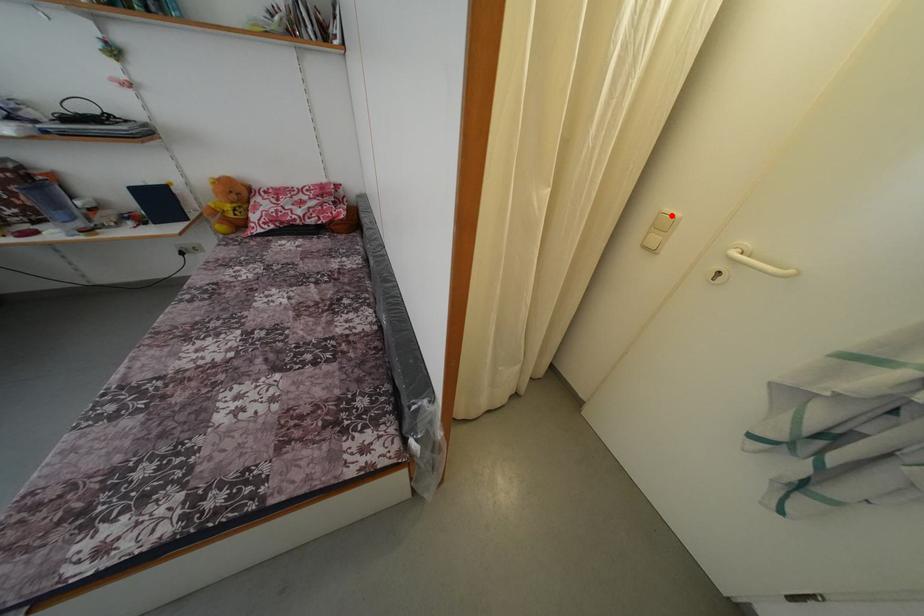
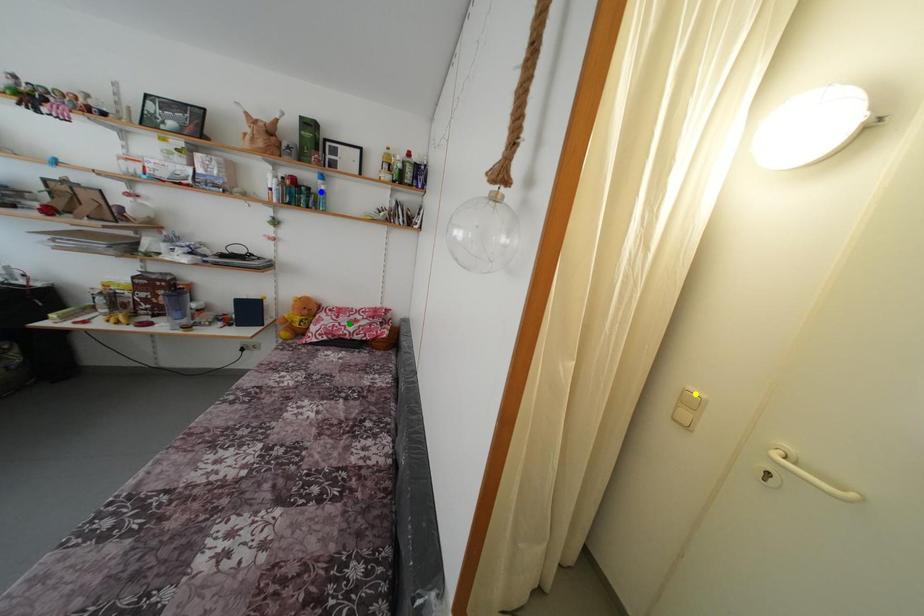
Question: I am providing you with two images of the same scene from different viewpoints. A red point is marked on the first image. You are given multiple points on the second image. Which point in image 2 represents the same 3d spot as the red point in image 1?

Choices:
 (A) yellow point
 (B) green point
 (C) blue point

Answer: (A)